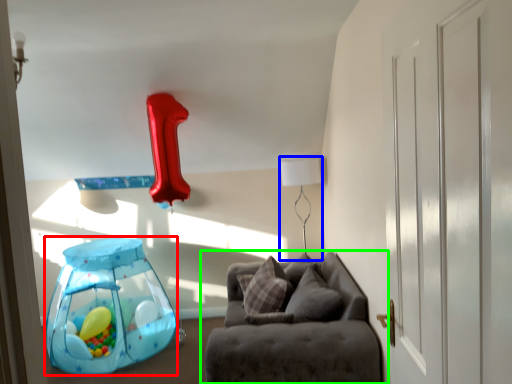
Question: Which object is positioned closest to balloon (highlighted by a red box)? Select from table lamp (highlighted by a blue box) and studio couch (highlighted by a green box).

Choices:
 (A) table lamp
 (B) studio couch

Answer: (B)